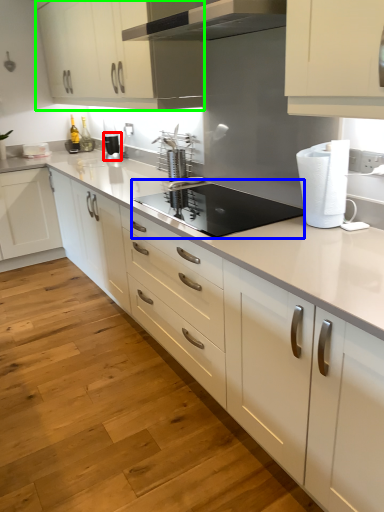
Question: Based on their relative distances, which object is nearer to kitchen appliance (highlighted by a red box)? Choose from appliance (highlighted by a blue box) and cabinetry (highlighted by a green box).

Choices:
 (A) appliance
 (B) cabinetry

Answer: (B)